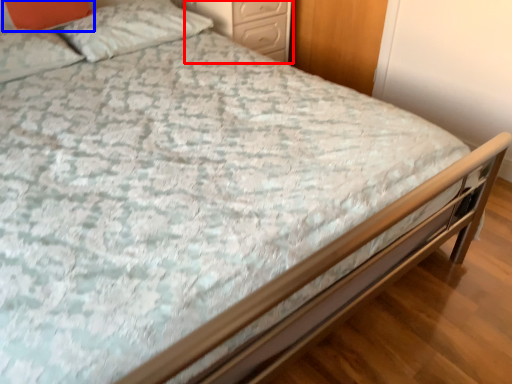
Question: Among these objects, which one is nearest to the camera, nightstand (highlighted by a red box) or pillow (highlighted by a blue box)?

Choices:
 (A) nightstand
 (B) pillow

Answer: (B)